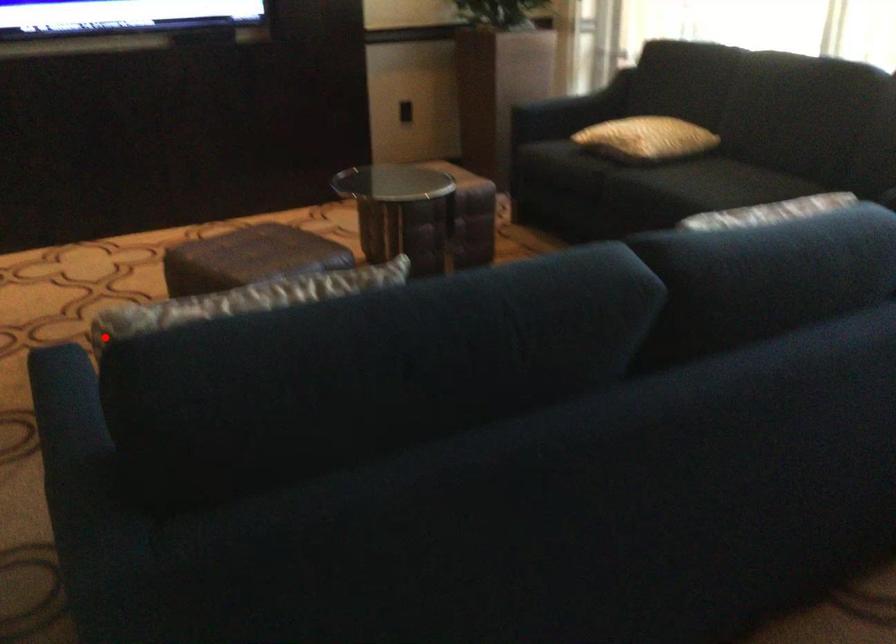
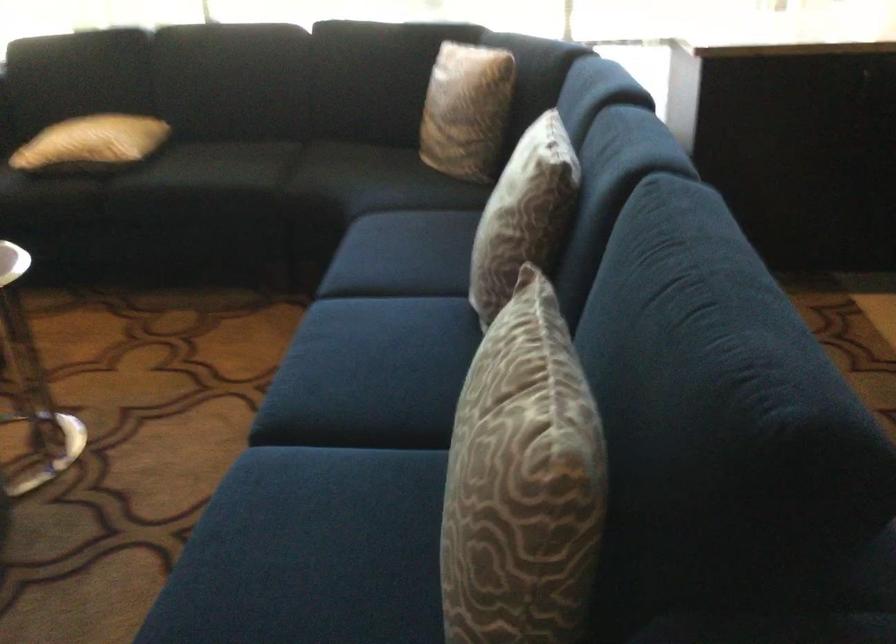
Question: I am providing you with two images of the same scene from different viewpoints. In image1, a red point is highlighted. Considering the same 3D point in image2, which of the following is correct?

Choices:
 (A) It is closer
 (B) It is farther

Answer: (A)